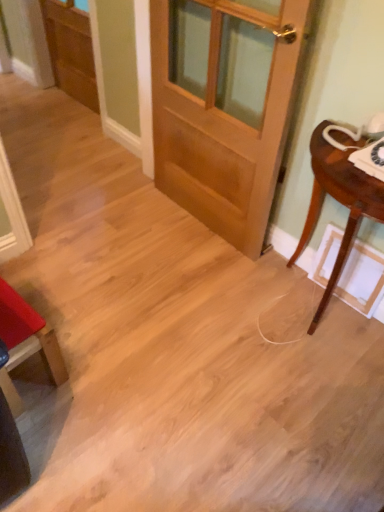
Question: Considering the positions of light brown wood door at center and mahogany wood table at right in the image, is light brown wood door at center taller or shorter than mahogany wood table at right?

Choices:
 (A) tall
 (B) short

Answer: (A)

Question: Considering the positions of point (183, 49) and point (377, 207), is point (183, 49) closer or farther from the camera than point (377, 207)?

Choices:
 (A) closer
 (B) farther

Answer: (B)

Question: Considering the real-world distances, which object is farthest from the matte red chair at lower left?

Choices:
 (A) wooden screen door at upper left
 (B) light brown wood door at center
 (C) mahogany wood table at right

Answer: (A)

Question: Which object is the closest to the light brown wood door at center?

Choices:
 (A) matte red chair at lower left
 (B) mahogany wood table at right
 (C) wooden screen door at upper left

Answer: (B)